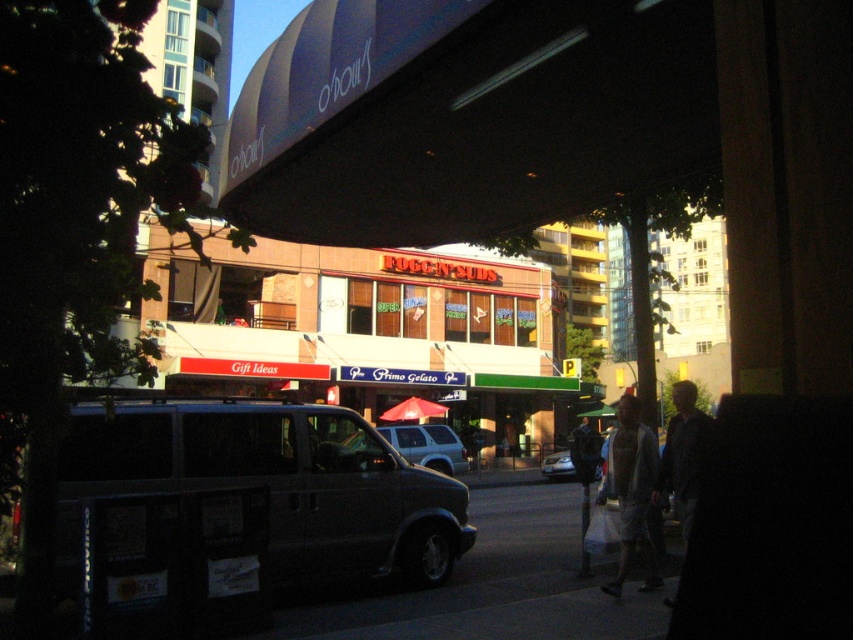
Who is shorter, light gray cotton t-shirt at lower right or dark gray pants at center?

light gray cotton t-shirt at lower right

Is the position of light gray cotton t-shirt at lower right less distant than that of dark gray pants at center?

Yes, it is in front of dark gray pants at center.

Locate an element on the screen. The width and height of the screenshot is (853, 640). light gray cotton t-shirt at lower right is located at coordinates (631, 490).

You are a GUI agent. You are given a task and a screenshot of the screen. Output one action in this format:
    pyautogui.click(x=<x>, y=<y>)
    Task: Click on the light gray cotton t-shirt at lower right
    This screenshot has height=640, width=853.
    Given the screenshot: What is the action you would take?
    pyautogui.click(x=631, y=490)

Between dark gray pants at center and red fabric umbrella at center, which one has more height?

With more height is dark gray pants at center.

Which is in front, point (576, 460) or point (431, 417)?

Positioned in front is point (576, 460).

Locate an element on the screen. dark gray pants at center is located at coordinates (584, 474).

Does point (303, 545) lie in front of point (462, 467)?

That is True.

Can you confirm if dark gray van at center is wider than silver metallic suv at center?

Indeed, dark gray van at center has a greater width compared to silver metallic suv at center.

Where is `dark gray van at center`? Image resolution: width=853 pixels, height=640 pixels. dark gray van at center is located at coordinates (268, 484).

Identify the location of dark gray van at center. coord(268,484).